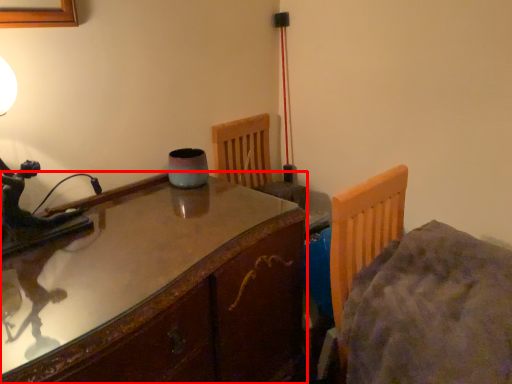
Question: From the image's perspective, what is the correct spatial positioning of table (annotated by the red box) in reference to bed?

Choices:
 (A) above
 (B) below

Answer: (B)